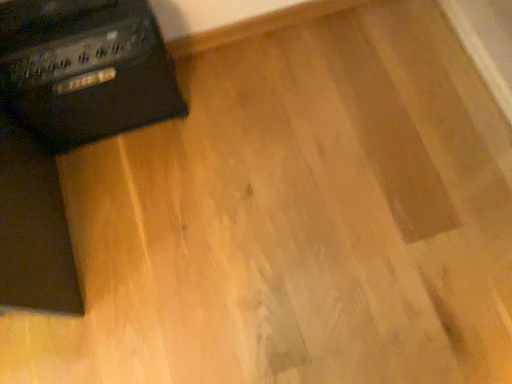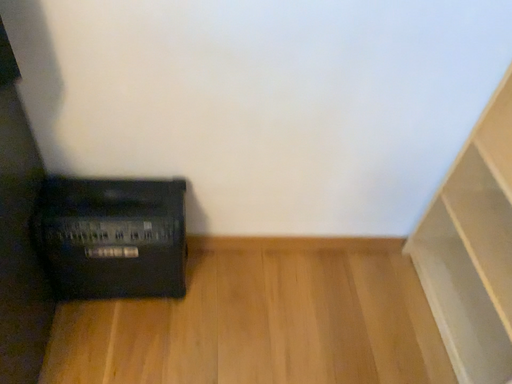
Question: How did the camera likely rotate when shooting the video?

Choices:
 (A) rotated upward
 (B) rotated downward

Answer: (A)